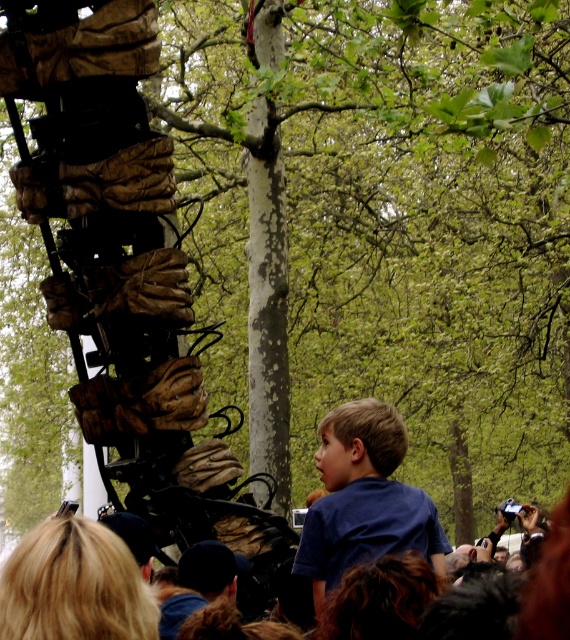
You are a photographer trying to capture the boy in the scene. You notice the blue cotton shirt at center and the dark blue fabric cap at center. Which clothing item is covering part of the other?

The blue cotton shirt at center is positioned over the dark blue fabric cap at center, so the shirt is covering part of the cap.

You are a photographer trying to capture a closeup of the blue cotton shirt at center and the dark blue fabric cap at center. Which object should you zoom in on to ensure both are fully visible in the frame?

The blue cotton shirt at center is wider than the dark blue fabric cap at center, so you should zoom in on the blue cotton shirt at center to ensure both are fully visible in the frame.

You are standing in the outdoor scene and want to walk towards the mechanical structure. There are two points marked on the ground, point A at coordinates point (339, 540) and point B at coordinates point (164, 596). Which point should you step on first if you want to approach the mechanical structure from the nearest path?

Point A at coordinates point (339, 540) is closer to the mechanical structure than point B at coordinates point (164, 596), so you should step on point A first.